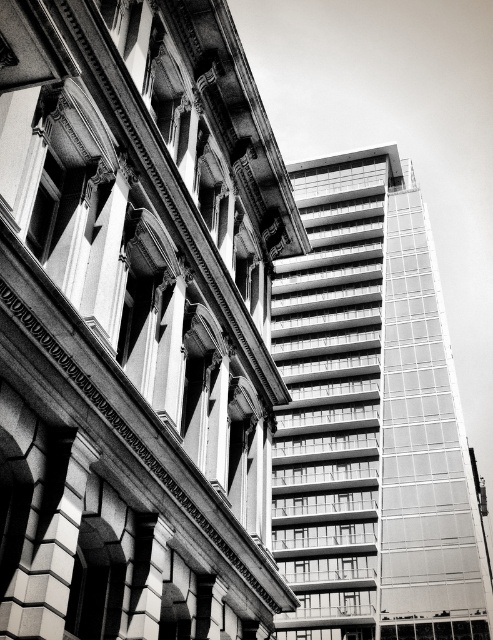
Question: Which of the following is the closest to the observer?

Choices:
 (A) glassy reflective building at right
 (B) smooth glass skyscraper at center

Answer: (B)

Question: Can you confirm if smooth glass skyscraper at center is thinner than glassy reflective building at right?

Choices:
 (A) yes
 (B) no

Answer: (A)

Question: Which point is farther to the camera?

Choices:
 (A) glassy reflective building at right
 (B) smooth glass skyscraper at center

Answer: (A)

Question: Can you confirm if smooth glass skyscraper at center is positioned to the left of glassy reflective building at right?

Choices:
 (A) yes
 (B) no

Answer: (A)

Question: Does smooth glass skyscraper at center have a lesser width compared to glassy reflective building at right?

Choices:
 (A) yes
 (B) no

Answer: (A)